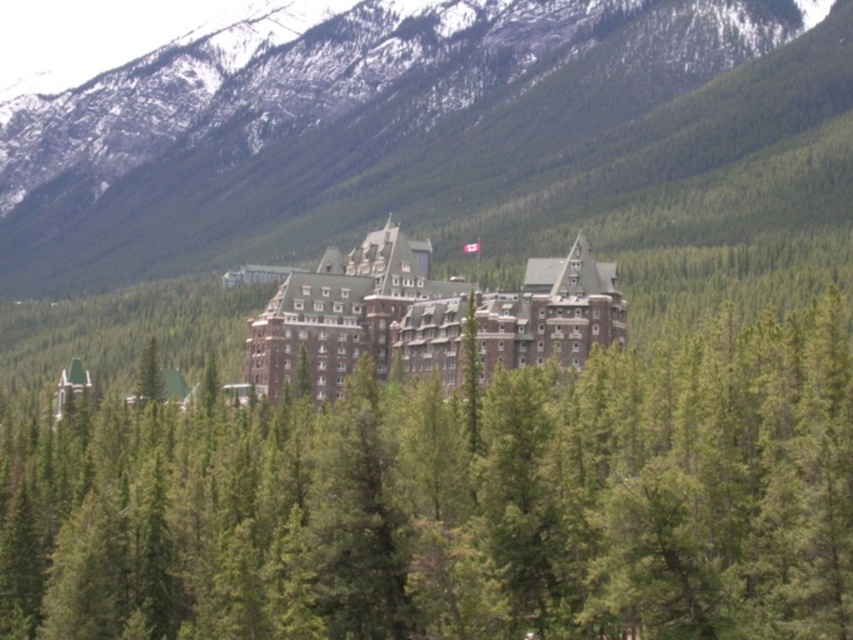
Can you confirm if green forested mountain at upper center is shorter than brown brick hotel at center?

No.

Based on the photo, can you confirm if green forested mountain at upper center is positioned to the left of brown brick hotel at center?

Indeed, green forested mountain at upper center is positioned on the left side of brown brick hotel at center.

Does point (728, 0) come behind point (546, 305)?

That is True.

Locate an element on the screen. Image resolution: width=853 pixels, height=640 pixels. green forested mountain at upper center is located at coordinates (408, 125).

Can you confirm if green textured tree at center is positioned to the left of brown brick hotel at center?

Correct, you'll find green textured tree at center to the left of brown brick hotel at center.

Who is positioned more to the right, green textured tree at center or brown brick hotel at center?

Positioned to the right is brown brick hotel at center.

Is point (250, 422) in front of point (572, 356)?

Yes.

At what (x,y) coordinates should I click in order to perform the action: click on green textured tree at center. Please return your answer as a coordinate pair (x, y). Looking at the image, I should click on (456, 502).

Does green textured tree at center have a greater height compared to green forested mountain at upper center?

Incorrect, green textured tree at center's height is not larger of green forested mountain at upper center's.

Consider the image. Does green textured tree at center have a lesser height compared to green forested mountain at upper center?

Correct, green textured tree at center is not as tall as green forested mountain at upper center.

Where is `green textured tree at center`? This screenshot has width=853, height=640. green textured tree at center is located at coordinates (456, 502).

Locate an element on the screen. This screenshot has width=853, height=640. green textured tree at center is located at coordinates (456, 502).